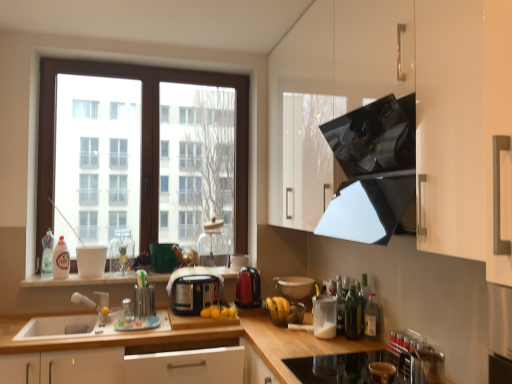
I want to click on vacant area situated to the left side of translucent plastic bottle at center, the third bottle positioned from the front, so click(305, 338).